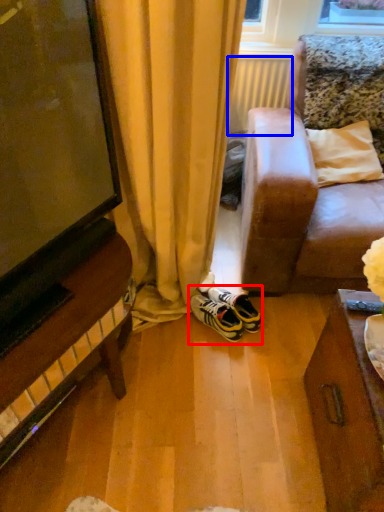
Question: Which object is closer to the camera taking this photo, footwear (highlighted by a red box) or radiator (highlighted by a blue box)?

Choices:
 (A) footwear
 (B) radiator

Answer: (A)